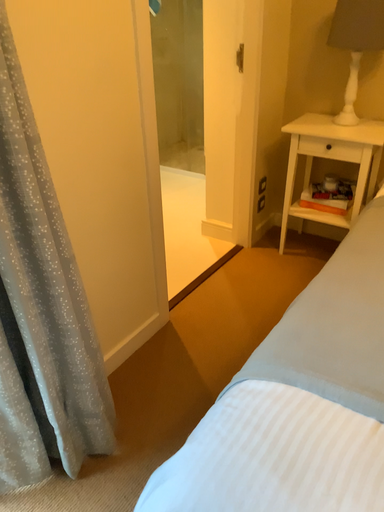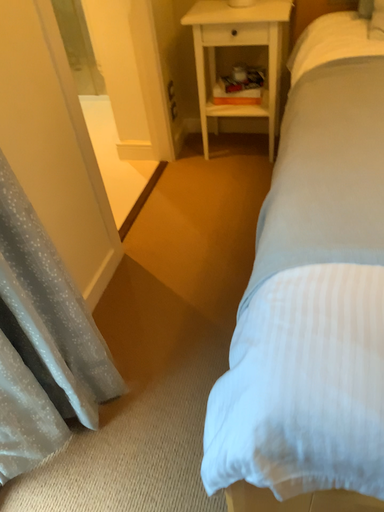
Question: How did the camera likely rotate when shooting the video?

Choices:
 (A) rotated right
 (B) rotated left

Answer: (A)